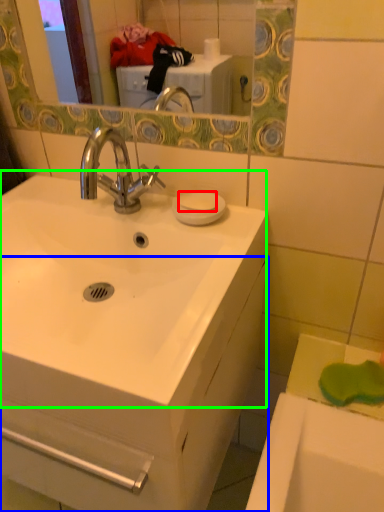
Question: Estimate the real-world distances between objects in this image. Which object is closer to soap (highlighted by a red box), bathroom cabinet (highlighted by a blue box) or sink (highlighted by a green box)?

Choices:
 (A) bathroom cabinet
 (B) sink

Answer: (B)